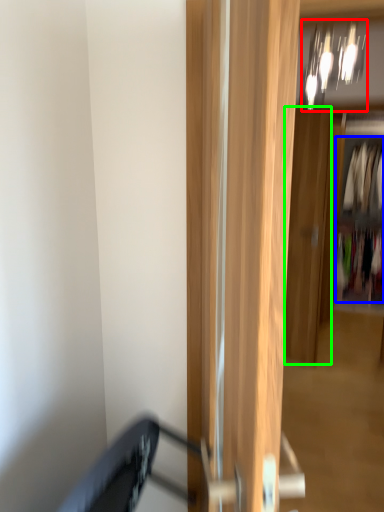
Question: Which is farther away from light fixture (highlighted by a red box)? clothing (highlighted by a blue box) or door (highlighted by a green box)?

Choices:
 (A) clothing
 (B) door

Answer: (A)